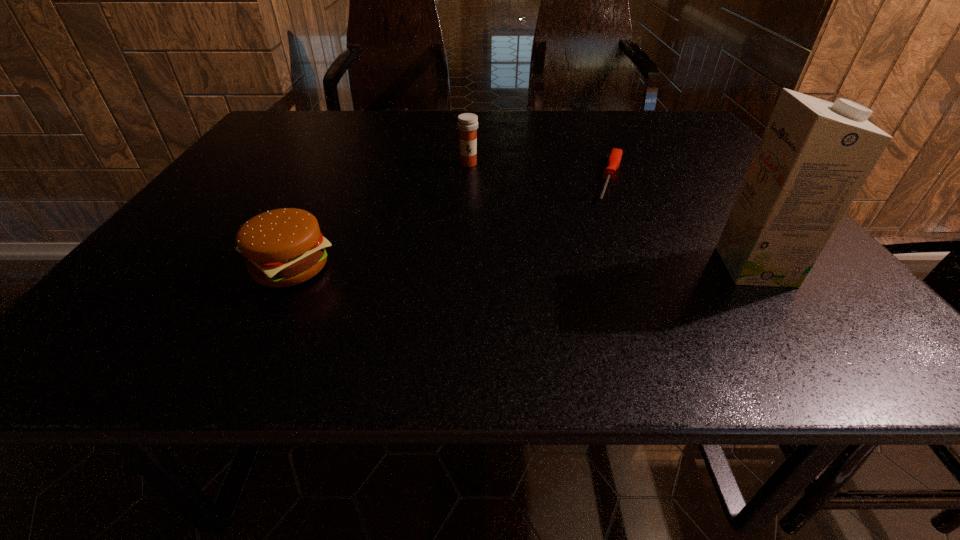
Where is `hamburger`? The height and width of the screenshot is (540, 960). hamburger is located at coordinates (284, 247).

Find the location of a particular element. Image resolution: width=960 pixels, height=540 pixels. the third tallest object is located at coordinates (284, 247).

This screenshot has height=540, width=960. Identify the location of the rightmost object. (814, 156).

Identify the location of carton. (814, 156).

The height and width of the screenshot is (540, 960). Identify the location of the third shortest object. (467, 124).

At what (x,y) coordinates should I click in order to perform the action: click on the third object from right to left. Please return your answer as a coordinate pair (x, y). Looking at the image, I should click on (467, 124).

At what (x,y) coordinates should I click in order to perform the action: click on the shortest object. Please return your answer as a coordinate pair (x, y). This screenshot has height=540, width=960. Looking at the image, I should click on (614, 159).

Identify the location of the third object from left to right. The image size is (960, 540). (614, 159).

You are a GUI agent. You are given a task and a screenshot of the screen. Output one action in this format:
    pyautogui.click(x=<x>, y=<y>)
    Task: Click on the vacant area located 0.150m on the back of the leftmost object
    
    Given the screenshot: What is the action you would take?
    pyautogui.click(x=324, y=202)

Where is `vacant space positioned 0.060m on the back of the rightmost object`? Image resolution: width=960 pixels, height=540 pixels. vacant space positioned 0.060m on the back of the rightmost object is located at coordinates 729,231.